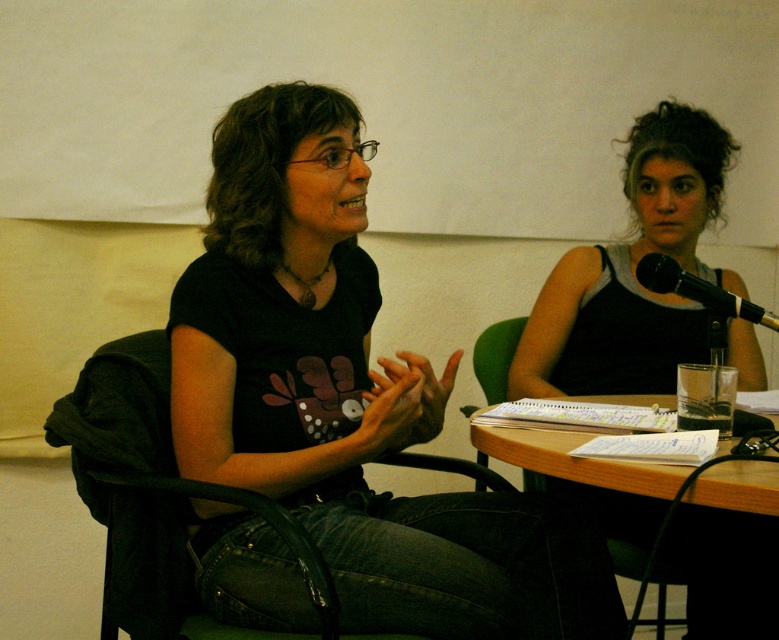
Question: Among these objects, which one is nearest to the camera?

Choices:
 (A) black metallic microphone at upper right
 (B) black tank top at right
 (C) wooden table at lower center
 (D) black matte t-shirt at center

Answer: (D)

Question: Which object is closer to the camera taking this photo?

Choices:
 (A) black plastic chair at left
 (B) wooden table at lower center

Answer: (A)

Question: Which object is the farthest from the black metallic microphone at upper right?

Choices:
 (A) black tank top at right
 (B) wooden table at lower center
 (C) black plastic chair at left
 (D) black matte t-shirt at center

Answer: (C)

Question: Can you confirm if black tank top at right is positioned below black plastic chair at left?

Choices:
 (A) no
 (B) yes

Answer: (A)

Question: Is black tank top at right wider than black metallic microphone at upper right?

Choices:
 (A) yes
 (B) no

Answer: (A)

Question: Does black tank top at right appear on the left side of black metallic microphone at upper right?

Choices:
 (A) no
 (B) yes

Answer: (A)